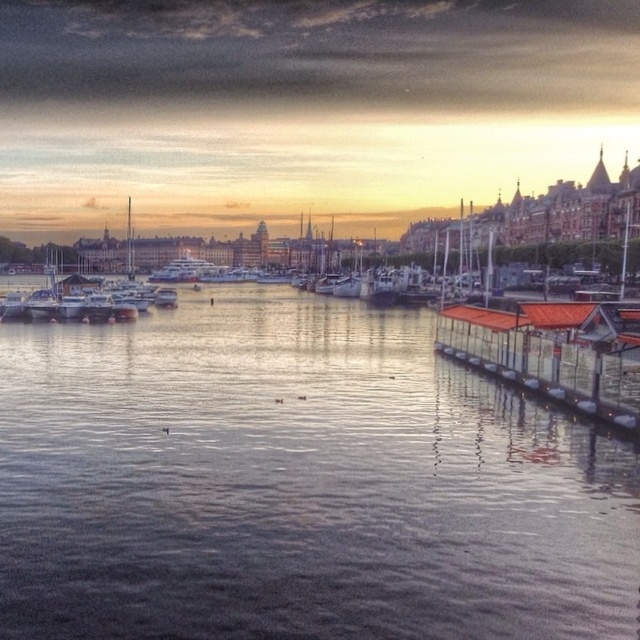
You are an artist planning to paint the harbor scene. You want to ensure the orange corrugated metal dock at lower right and the smooth water at center are proportionally accurate. Which one should you paint larger in your artwork?

The smooth water at center is bigger than the orange corrugated metal dock at lower right, so you should paint the smooth water at center larger in your artwork.

You are standing on the dock with the red roof and want to locate the smooth water at center. According to the coordinates provided, in which direction should you look relative to your position?

The smooth water at center is located at coordinates point (298, 483). Since the coordinate system typically places the origin at the bottom left corner, the x value of 0.756 indicates a position to the right, and the y value of 0.466 suggests a position above your current location on the dock. Therefore, you should look towards the upper right direction to find the smooth water at center.

You are standing on the orange corrugated metal dock at lower right and want to look across to the smooth water at center. Which object is higher in elevation?

The smooth water at center is taller than the orange corrugated metal dock at lower right, so the smooth water at center is higher in elevation.